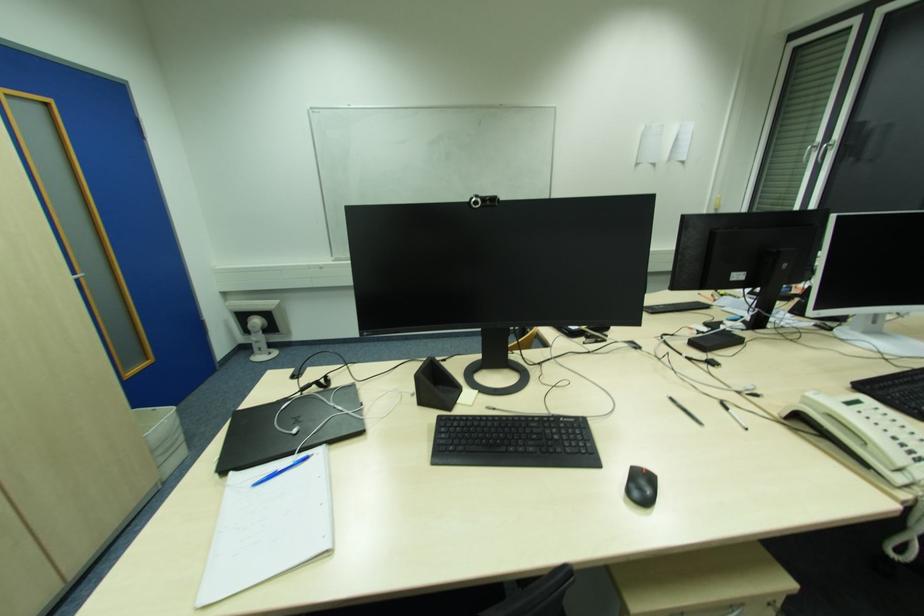
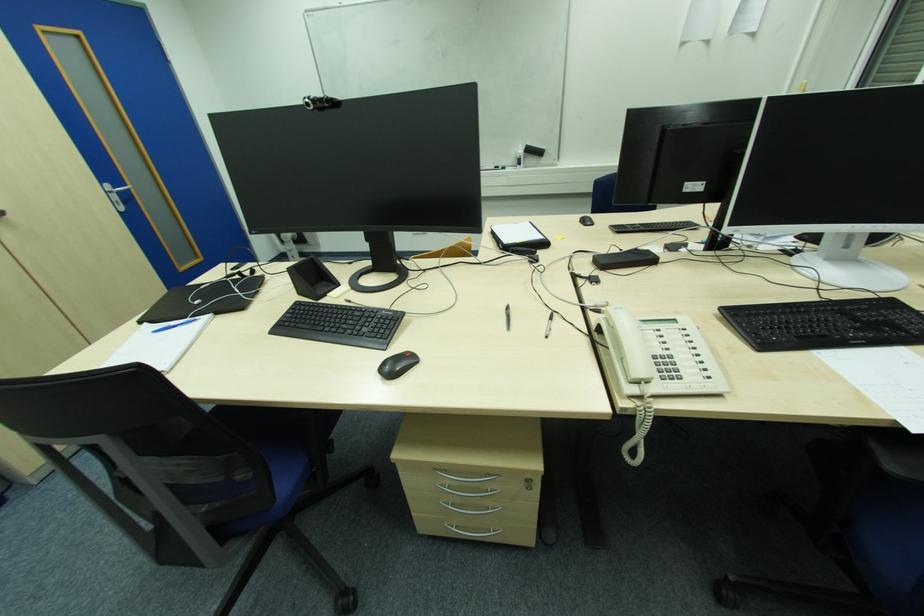
Question: How did the camera likely rotate?

Choices:
 (A) Left
 (B) Right
 (C) Up
 (D) Down

Answer: (A)